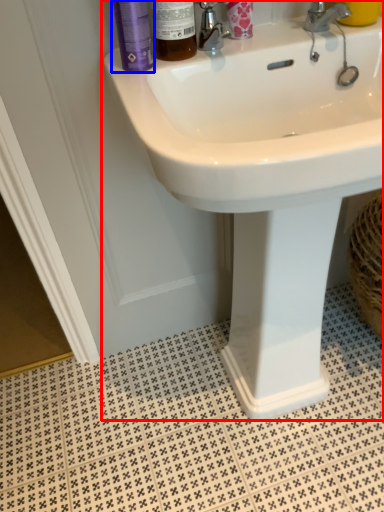
Question: Which object is closer to the camera taking this photo, sink (highlighted by a red box) or mouthwash (highlighted by a blue box)?

Choices:
 (A) sink
 (B) mouthwash

Answer: (A)